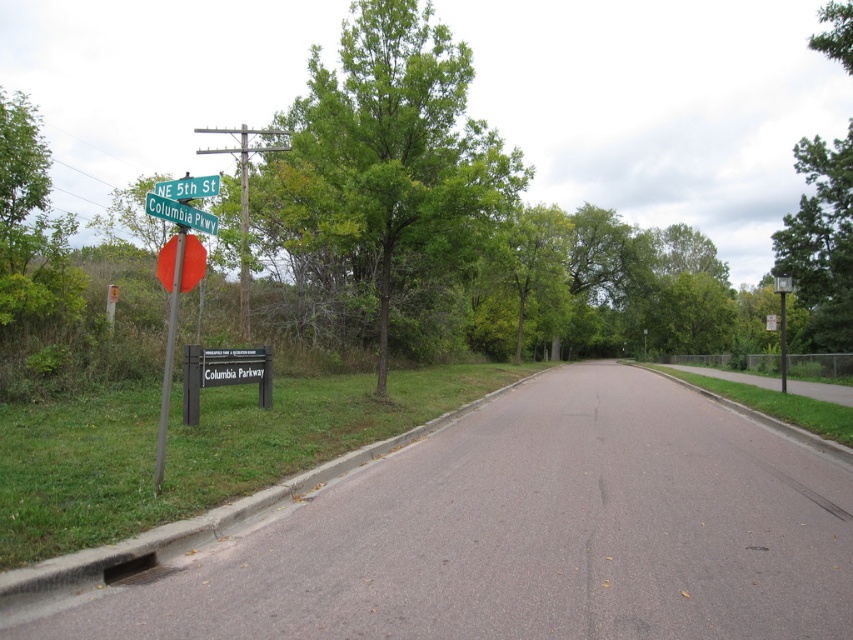
Is black metal sign at lower left positioned behind metallic pole at center?

No, black metal sign at lower left is closer to the viewer.

Is black metal sign at lower left positioned before metallic pole at center?

Yes, it is in front of metallic pole at center.

Measure the distance between point (189,408) and camera.

Point (189,408) is 34.59 feet away from camera.

I want to click on black metal sign at lower left, so click(223, 374).

Between green leafy tree at center and matte red stop sign at left, which one is positioned higher?

green leafy tree at center is above.

Who is shorter, green leafy tree at center or matte red stop sign at left?

With less height is matte red stop sign at left.

At what (x,y) coordinates should I click in order to perform the action: click on green leafy tree at center. Please return your answer as a coordinate pair (x, y). The image size is (853, 640). Looking at the image, I should click on (392, 154).

Does point (492, 166) come behind point (265, 362)?

Yes, it is behind point (265, 362).

Is point (291, 157) positioned behind point (213, 355)?

Yes, it is.

Where is `green leafy tree at center`? The image size is (853, 640). green leafy tree at center is located at coordinates (392, 154).